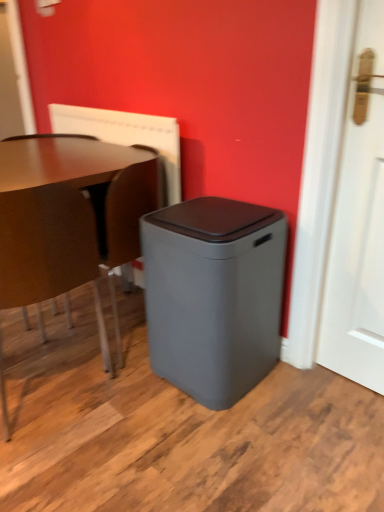
The image size is (384, 512). Find the location of `matte brown chair at left`. matte brown chair at left is located at coordinates (49, 249).

Describe the element at coordinates (127, 136) in the screenshot. The width and height of the screenshot is (384, 512). I see `white textured radiator at upper center` at that location.

What is the approximate width of brown leather swivel chair at lower left?

brown leather swivel chair at lower left is 16.89 inches in width.

Identify the location of white matte door at right. (359, 219).

Locate an element on the screen. This screenshot has height=512, width=384. matte brown chair at left is located at coordinates (49, 249).

From the picture: Which of these two, white matte door at right or gray matte waste container at center, is smaller?

Smaller between the two is white matte door at right.

The image size is (384, 512). What are the coordinates of `door that appears in front of the gray matte waste container at center` in the screenshot? It's located at tap(359, 219).

Which point is more forward, (x=371, y=194) or (x=205, y=381)?

The point (x=371, y=194) is in front.

Is white matte door at right at the right side of gray matte waste container at center?

Yes, white matte door at right is to the right of gray matte waste container at center.

Is the depth of matte brown chair at left less than that of gray matte waste container at center?

Yes, matte brown chair at left is closer to the viewer.

From a real-world perspective, is matte brown chair at left on top of gray matte waste container at center?

Yes, from a real-world perspective, matte brown chair at left is over gray matte waste container at center

Can you confirm if matte brown chair at left is taller than gray matte waste container at center?

Indeed, matte brown chair at left has a greater height compared to gray matte waste container at center.

Where is `swivel chair in front of the white textured radiator at upper center`? swivel chair in front of the white textured radiator at upper center is located at coordinates pos(124,218).

Can you confirm if brown leather swivel chair at lower left is bigger than white textured radiator at upper center?

Indeed, brown leather swivel chair at lower left has a larger size compared to white textured radiator at upper center.

Is brown leather swivel chair at lower left to the left or to the right of white textured radiator at upper center in the image?

In the image, brown leather swivel chair at lower left appears on the right side of white textured radiator at upper center.

Does point (138, 241) come closer to viewer compared to point (169, 179)?

Yes, point (138, 241) is in front of point (169, 179).

Is matte brown chair at left positioned with its back to white textured radiator at upper center?

No, matte brown chair at left is not facing away from white textured radiator at upper center.

What's the angular difference between matte brown chair at left and white textured radiator at upper center's facing directions?

The angle between the facing direction of matte brown chair at left and the facing direction of white textured radiator at upper center is 180 degrees.

Locate an element on the screen. radiator above the matte brown chair at left (from a real-world perspective) is located at coordinates (127, 136).

From the picture: Would you say matte brown chair at left contains white textured radiator at upper center?

No, white textured radiator at upper center is not surrounded by matte brown chair at left.

Is white matte door at right smaller than matte brown chair at left?

Yes.

From a real-world perspective, is white matte door at right beneath matte brown chair at left?

No, from a real-world perspective, white matte door at right is not beneath matte brown chair at left.

In the scene shown: Can you confirm if white matte door at right is shorter than matte brown chair at left?

Incorrect, the height of white matte door at right does not fall short of that of matte brown chair at left.

From the image's perspective, is white matte door at right above or below matte brown chair at left?

Based on their image positions, white matte door at right is located above matte brown chair at left.

Who is bigger, white textured radiator at upper center or matte brown chair at left?

Bigger between the two is matte brown chair at left.

From a real-world perspective, which object rests below the other?

matte brown chair at left.

Can you tell me how much white textured radiator at upper center and matte brown chair at left differ in facing direction?

The angular difference between white textured radiator at upper center and matte brown chair at left is 180 degrees.

Which is more to the right, brown leather swivel chair at lower left or white matte door at right?

Positioned to the right is white matte door at right.

From a real-world perspective, which object stands above the other?

From a 3D spatial view, white matte door at right is above.

Is brown leather swivel chair at lower left oriented towards white matte door at right?

No, brown leather swivel chair at lower left is not aimed at white matte door at right.

Is brown leather swivel chair at lower left next to white matte door at right?

They are not placed beside each other.

The image size is (384, 512). What are the coordinates of `waste container that appears below the white matte door at right (from the image's perspective)` in the screenshot? It's located at (213, 295).

The image size is (384, 512). Find the location of `waste container that appears on the right of matte brown chair at left`. waste container that appears on the right of matte brown chair at left is located at coordinates (213, 295).

Which object lies further to the anchor point white matte door at right, gray matte waste container at center or matte brown chair at left?

matte brown chair at left.

From the image, which object appears to be nearer to white textured radiator at upper center, white matte door at right or matte brown chair at left?

matte brown chair at left is closer to white textured radiator at upper center.

Based on their spatial positions, is brown leather swivel chair at lower left or matte brown chair at left further from white matte door at right?

matte brown chair at left is positioned further to the anchor white matte door at right.

Which object lies nearer to the anchor point white textured radiator at upper center, gray matte waste container at center or white matte door at right?

Based on the image, gray matte waste container at center appears to be nearer to white textured radiator at upper center.

Considering their positions, is white matte door at right positioned closer to matte brown chair at left than gray matte waste container at center?

gray matte waste container at center lies closer to matte brown chair at left than the other object.

Looking at the image, which one is located closer to brown leather swivel chair at lower left, white textured radiator at upper center or white matte door at right?

The object closer to brown leather swivel chair at lower left is white textured radiator at upper center.

When comparing their distances from gray matte waste container at center, does white matte door at right or brown leather swivel chair at lower left seem further?

Based on the image, white matte door at right appears to be further to gray matte waste container at center.

Looking at this image, when comparing their distances from gray matte waste container at center, does white textured radiator at upper center or brown leather swivel chair at lower left seem closer?

brown leather swivel chair at lower left.

Find the location of a particular element. waste container between matte brown chair at left and white matte door at right is located at coordinates tap(213, 295).

You are a GUI agent. You are given a task and a screenshot of the screen. Output one action in this format:
    pyautogui.click(x=<x>, y=<y>)
    Task: Click on the waste container between white textured radiator at upper center and white matte door at right from left to right
    
    Given the screenshot: What is the action you would take?
    pyautogui.click(x=213, y=295)

Identify the location of waste container between brown leather swivel chair at lower left and white matte door at right from left to right. (213, 295).

Image resolution: width=384 pixels, height=512 pixels. Find the location of `swivel chair between matte brown chair at left and gray matte waste container at center`. swivel chair between matte brown chair at left and gray matte waste container at center is located at coordinates (124, 218).